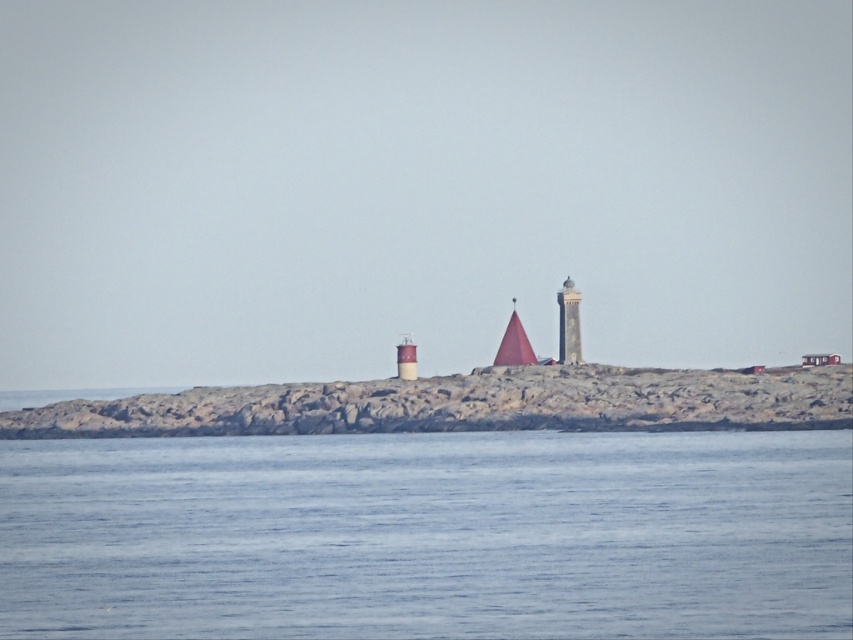
You are a drone operator trying to capture a photo of the coastal scene. The blue water at center is at point (428, 536). If you want to focus on the blue water at center, which point should you aim your drone camera at?

The blue water at center is located at point (428, 536), so you should aim your drone camera at point (428, 536).

You are a bird soaring above the coastal scene. You want to land on the highest point available. Which would you choose between the rocky island at center and the smooth gray tower at center?

The smooth gray tower at center is taller than the rocky island at center, so the bird should land on the smooth gray tower at center.

You are a photographer positioned at the edge of the rocky outcrop. You want to capture both the smooth gray tower at center and the smooth brown tower at center in a single shot. Which tower will appear closer to the camera in the photo?

The smooth gray tower at center will appear closer to the camera because the smooth brown tower at center is positioned behind it.